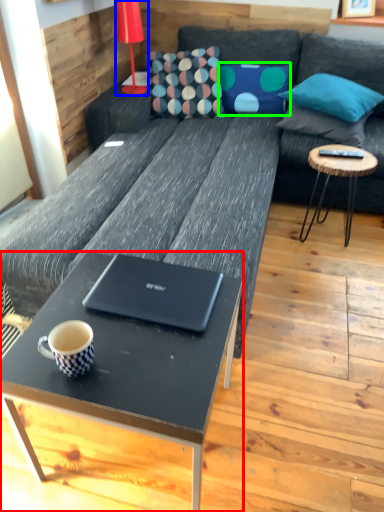
Question: Which object is the closest to the coffee table (highlighted by a red box)? Choose among these: lamp (highlighted by a blue box) or pillow (highlighted by a green box).

Choices:
 (A) lamp
 (B) pillow

Answer: (A)